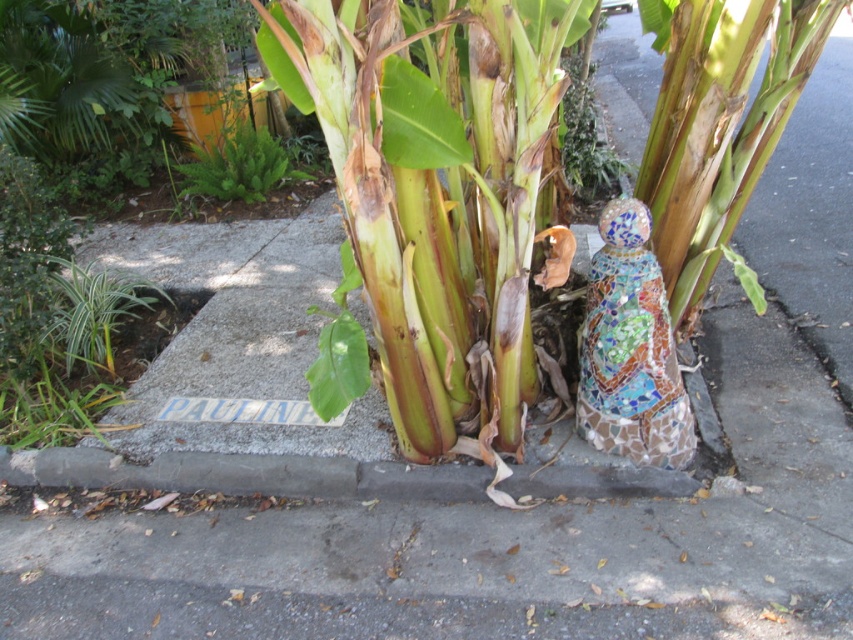
Question: Is gray concrete curb at lower center closer to the viewer compared to mosaic figure at center?

Choices:
 (A) no
 (B) yes

Answer: (A)

Question: Which of these objects is positioned closest to the green matte banana tree at center?

Choices:
 (A) mosaic figure at center
 (B) gray concrete curb at lower center

Answer: (A)

Question: Which of the following is the closest to the observer?

Choices:
 (A) green matte banana tree at center
 (B) gray concrete curb at lower center

Answer: (A)

Question: Does green matte banana tree at center appear under gray concrete curb at lower center?

Choices:
 (A) yes
 (B) no

Answer: (B)

Question: Which point appears farthest from the camera in this image?

Choices:
 (A) (502, 420)
 (B) (596, 445)

Answer: (B)

Question: Can you confirm if gray concrete curb at lower center is wider than mosaic figure at center?

Choices:
 (A) no
 (B) yes

Answer: (B)